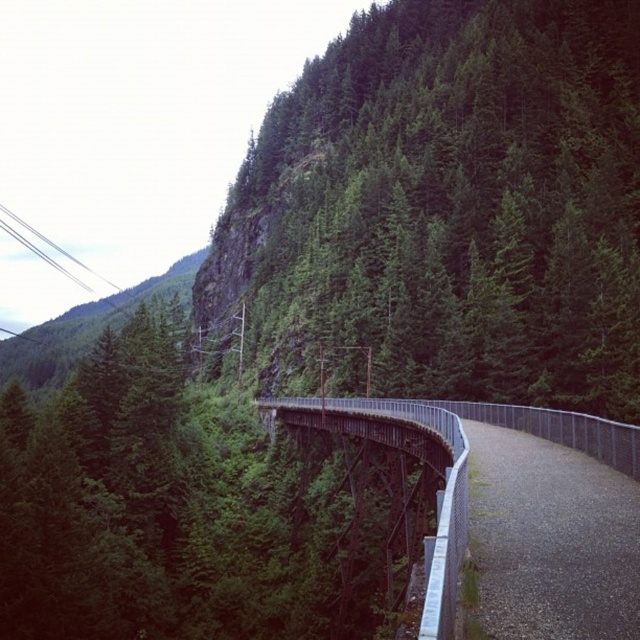
Does green leafy tree at center appear on the left side of metallic gray bridge at center?

No, green leafy tree at center is not to the left of metallic gray bridge at center.

Between point (333, 202) and point (376, 413), which one is positioned in front?

Point (376, 413) is more forward.

The height and width of the screenshot is (640, 640). I want to click on green leafy tree at center, so click(x=445, y=209).

Locate an element on the screen. The image size is (640, 640). green leafy tree at center is located at coordinates (445, 209).

Does gray gravel path at center-right have a lesser width compared to metallic gray bridge at center?

Correct, gray gravel path at center-right's width is less than metallic gray bridge at center's.

Does gray gravel path at center-right have a lesser height compared to metallic gray bridge at center?

Indeed, gray gravel path at center-right has a lesser height compared to metallic gray bridge at center.

Describe the element at coordinates (550, 540) in the screenshot. I see `gray gravel path at center-right` at that location.

At what (x,y) coordinates should I click in order to perform the action: click on gray gravel path at center-right. Please return your answer as a coordinate pair (x, y). Looking at the image, I should click on (550, 540).

The image size is (640, 640). What do you see at coordinates (445, 209) in the screenshot?
I see `green leafy tree at center` at bounding box center [445, 209].

Who is taller, green leafy tree at center or gray gravel path at center-right?

green leafy tree at center

In order to click on green leafy tree at center in this screenshot , I will do `click(445, 209)`.